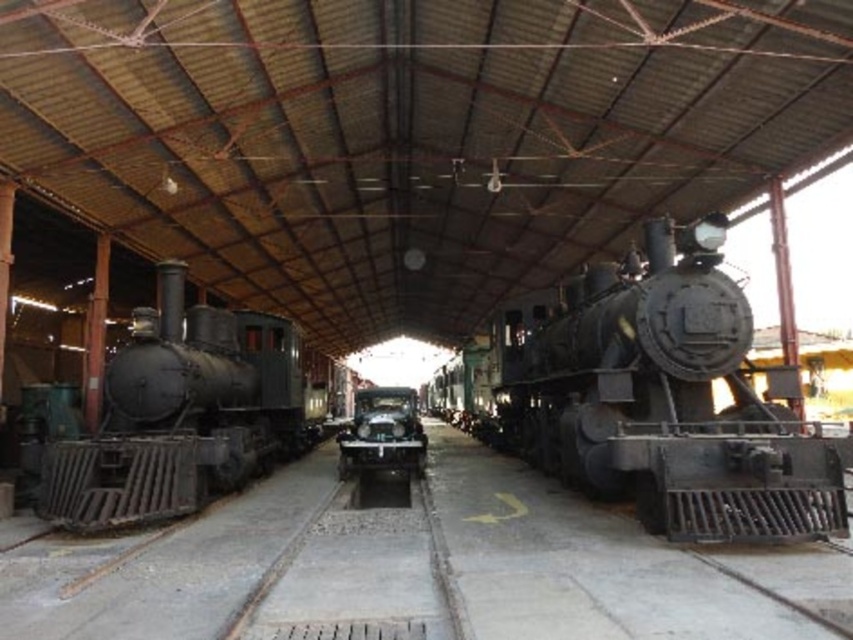
Is matte black locomotive at left above shiny silver car at center?

Yes, matte black locomotive at left is above shiny silver car at center.

Where is `matte black locomotive at left`? This screenshot has height=640, width=853. matte black locomotive at left is located at coordinates (184, 413).

Locate an element on the screen. Image resolution: width=853 pixels, height=640 pixels. matte black locomotive at left is located at coordinates (184, 413).